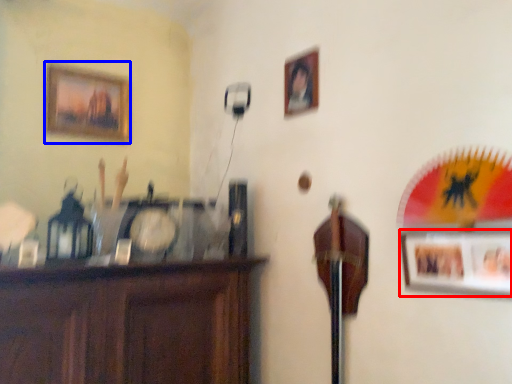
Question: Among these objects, which one is farthest to the camera, picture frame (highlighted by a red box) or picture frame (highlighted by a blue box)?

Choices:
 (A) picture frame
 (B) picture frame

Answer: (B)